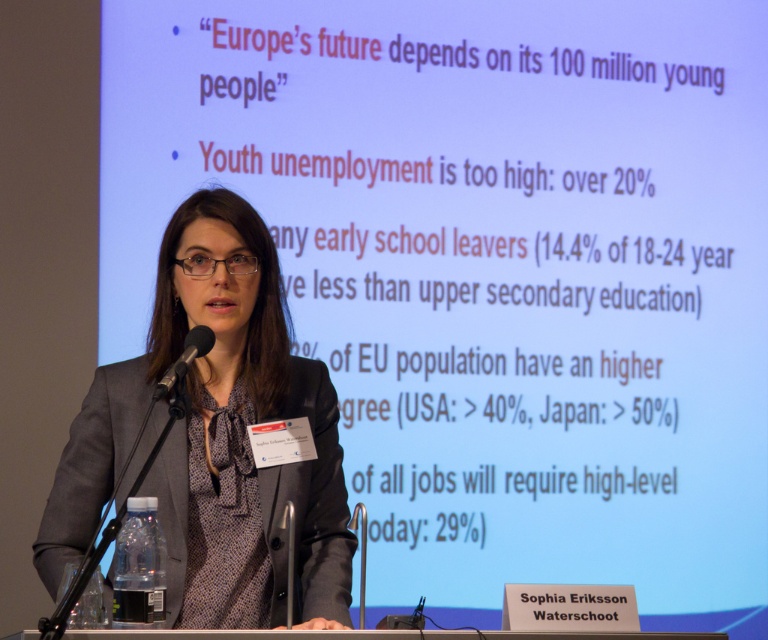
You are a photographer at the event and want to capture a photo of the speaker. The photographer needs to ensure that both the matte gray blazer at center and the black matte microphone at left are visible in the frame. Based on their positions, which object should appear higher in the photo?

The black matte microphone at left appears higher in the photo because the matte gray blazer at center is located below it.

You are organizing a conference and need to ensure that the microphone is visible to all attendees. Given the sizes of the matte gray blazer at center and the black matte microphone at left, which object is larger and might block the microphone if placed too close?

The matte gray blazer at center is bigger than the black matte microphone at left. Therefore, the blazer could potentially block the microphone if positioned too closely, so it should be placed further away to ensure visibility.

You are a conference attendee who wants to take a photo of the speaker and the projection screen. You are standing at point A, which is at the same position as point (187,340). There is an obstruction at point B, which is at the same position as point (310,588). Will you be able to take a clear photo of both the speaker and the screen without the obstruction blocking the view?

Point (310,588) is behind point (187,340), so the obstruction at point B will not block your view from point A. You can take a clear photo of both the speaker and the screen.